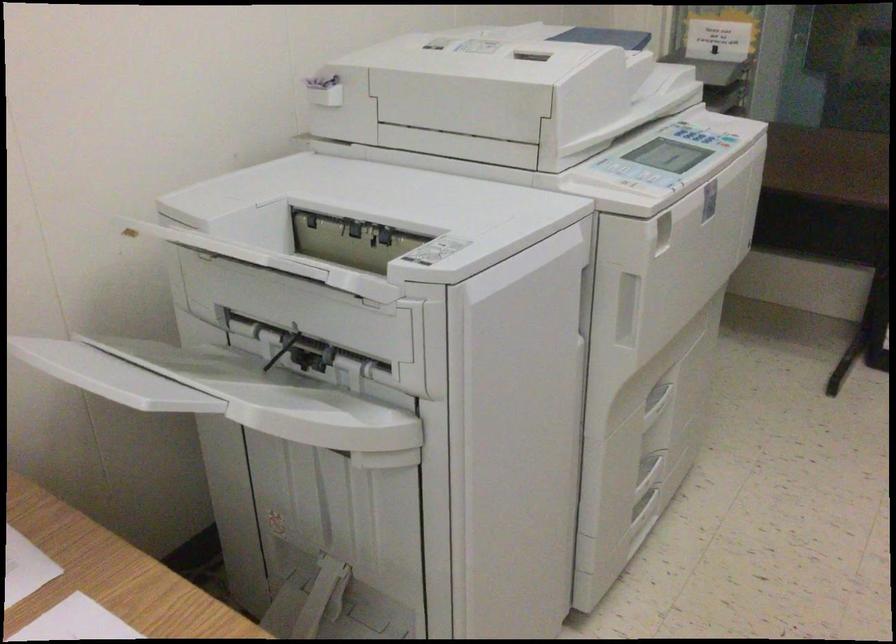
Where would you press the copier keypad button? Please return your answer as a coordinate pair (x, y).

(668, 155)